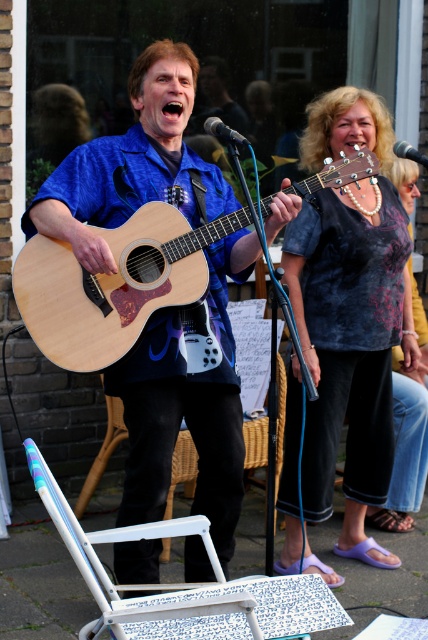
From the picture: Is white painted wood folding chair at lower left positioned in front of metallic silver microphone at center?

Yes, white painted wood folding chair at lower left is closer to the viewer.

Does point (136, 621) come behind point (419, 163)?

No.

I want to click on white painted wood folding chair at lower left, so click(136, 584).

Does matte wood guitar at center have a larger size compared to pearl necklace at upper center?

No.

Consider the image. Can you confirm if matte wood guitar at center is positioned above pearl necklace at upper center?

Yes, matte wood guitar at center is above pearl necklace at upper center.

Is point (100, 147) positioned in front of point (338, 429)?

That is True.

Image resolution: width=428 pixels, height=640 pixels. What are the coordinates of `matte wood guitar at center` in the screenshot? It's located at (187, 403).

Between natural wood acoustic guitar at center and metallic silver microphone at center, which one appears on the left side from the viewer's perspective?

Positioned to the left is natural wood acoustic guitar at center.

Who is more forward, (77, 342) or (421, 154)?

Point (77, 342) is in front.

I want to click on natural wood acoustic guitar at center, so click(113, 284).